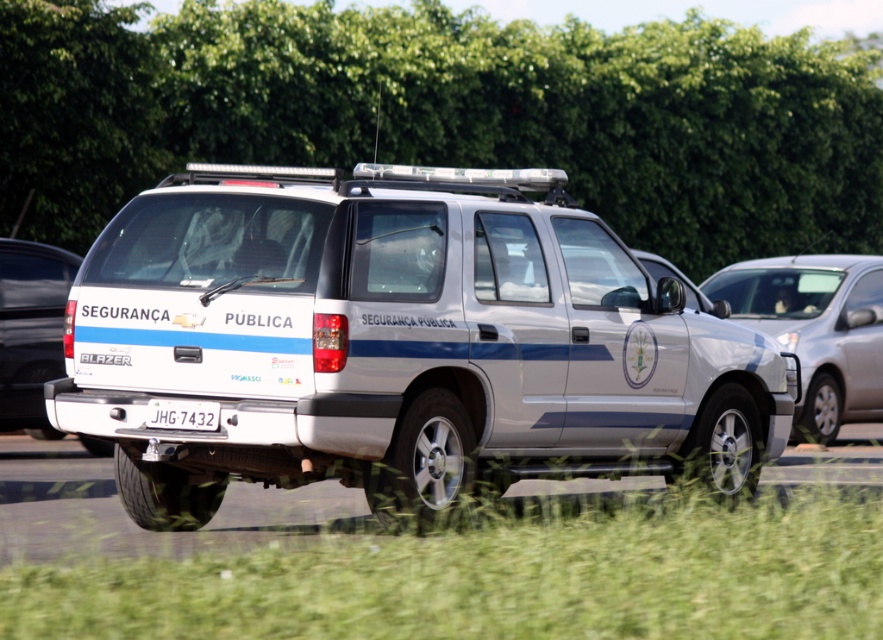
Question: Considering the real-world distances, which object is closest to the white metallic police car at center?

Choices:
 (A) green leafy hedge at upper center
 (B) white matte suv at left

Answer: (B)

Question: Which of the following is the farthest from the observer?

Choices:
 (A) (819, 330)
 (B) (54, 268)

Answer: (A)

Question: Can you confirm if green leafy hedge at upper center is wider than white glossy suv at right?

Choices:
 (A) no
 (B) yes

Answer: (B)

Question: Does green leafy hedge at upper center have a smaller size compared to white matte suv at left?

Choices:
 (A) no
 (B) yes

Answer: (A)

Question: Does white metallic police car at center have a smaller size compared to white plastic license plate at center?

Choices:
 (A) no
 (B) yes

Answer: (A)

Question: Among these objects, which one is nearest to the camera?

Choices:
 (A) white metallic police car at center
 (B) white plastic license plate at center
 (C) green leafy hedge at upper center

Answer: (A)